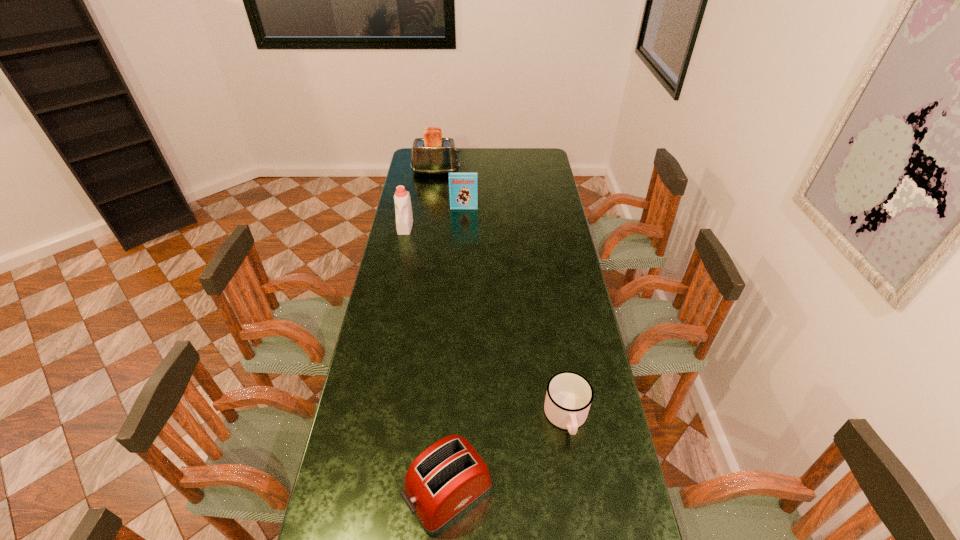
The image size is (960, 540). Find the location of `unoccupied area between the tallest object and the mug`. unoccupied area between the tallest object and the mug is located at coordinates (501, 294).

This screenshot has width=960, height=540. Find the location of `the closest object to the shorter toaster`. the closest object to the shorter toaster is located at coordinates (569, 395).

Select which object is the second closest to the farther toaster. Please provide its 2D coordinates. Your answer should be formatted as a tuple, i.e. [(x, y)], where the tuple contains the x and y coordinates of a point satisfying the conditions above.

[(404, 218)]

This screenshot has height=540, width=960. I want to click on free location that satisfies the following two spatial constraints: 1. on the side of the farther toaster with the control lever; 2. on the right side of the nearer toaster, so click(390, 491).

Identify the location of vacant space that satisfies the following two spatial constraints: 1. on the side of the shorter toaster with the control lever; 2. on the right side of the farthest object. (390, 491).